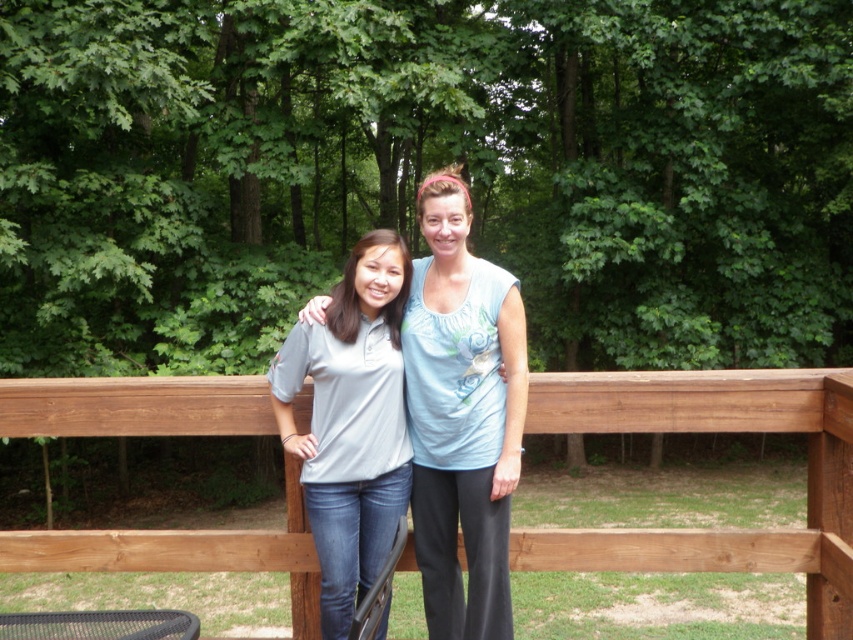
You are a photographer trying to capture a photo of the brown wooden fence at center and the light blue cotton shirt at center. Which object should you zoom in on to focus on the smaller one?

The light blue cotton shirt at center is smaller in width than the brown wooden fence at center, so you should zoom in on the light blue cotton shirt at center to focus on the smaller one.

You are standing on the wooden deck and want to reach the point marked at coordinates (572,552). Considering the deck is 10 feet long from your current position, will you be able to walk straight to that point without stepping off the deck?

The point at coordinates (572,552) is 11.89 feet away from the viewer. Since the deck is only 10 feet long from your current position, walking straight to that point would require stepping off the deck as it is beyond the deck length.